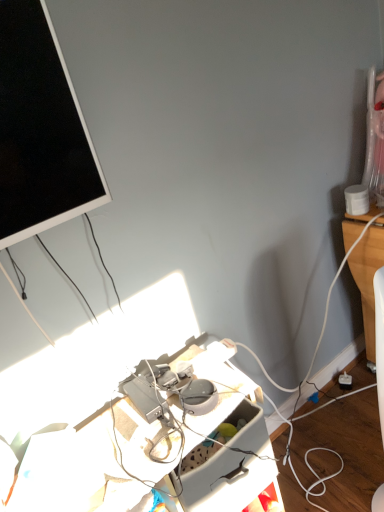
Image resolution: width=384 pixels, height=512 pixels. What do you see at coordinates (345, 381) in the screenshot?
I see `white plastic power outlet at lower right` at bounding box center [345, 381].

What do you see at coordinates (227, 447) in the screenshot? I see `plastic gray desk at center` at bounding box center [227, 447].

Locate an element on the screen. white plastic power outlet at lower right is located at coordinates (345, 381).

Is plastic gray desk at center facing towards white plastic power outlet at lower right?

No, plastic gray desk at center is not oriented towards white plastic power outlet at lower right.

Is white plastic power outlet at lower right inside plastic gray desk at center?

No, plastic gray desk at center does not contain white plastic power outlet at lower right.

Considering the points (196, 487) and (341, 384), which point is behind, point (196, 487) or point (341, 384)?

The point (341, 384) is more distant.

From the image's perspective, between plastic gray desk at center and white plastic power outlet at lower right, which one is located above?

plastic gray desk at center is shown above in the image.

Is white plastic power outlet at lower right inside or outside of matte black screen at upper left?

white plastic power outlet at lower right is located beyond the bounds of matte black screen at upper left.

Considering the relative sizes of white plastic power outlet at lower right and matte black screen at upper left in the image provided, is white plastic power outlet at lower right taller than matte black screen at upper left?

Incorrect, the height of white plastic power outlet at lower right is not larger of that of matte black screen at upper left.

How many degrees apart are the facing directions of white plastic power outlet at lower right and plastic gray desk at center?

9.32 degrees.

From the image's perspective, is white plastic power outlet at lower right below plastic gray desk at center?

Indeed, from the image's perspective, white plastic power outlet at lower right is shown beneath plastic gray desk at center.

Does point (347, 375) lie behind point (173, 439)?

Yes, it is behind point (173, 439).

Is white plastic power outlet at lower right next to plastic gray desk at center and touching it?

No, white plastic power outlet at lower right is not next to plastic gray desk at center.

Does matte black screen at upper left have a greater height compared to white plastic power outlet at lower right?

Indeed, matte black screen at upper left has a greater height compared to white plastic power outlet at lower right.

In the scene shown: Is matte black screen at upper left positioned beyond the bounds of white plastic power outlet at lower right?

Yes.

Is matte black screen at upper left in front of white plastic power outlet at lower right?

Yes, matte black screen at upper left is in front of white plastic power outlet at lower right.

From the image's perspective, relative to matte black screen at upper left, is plastic gray desk at center above or below?

plastic gray desk at center is below matte black screen at upper left.

Consider the image. Is matte black screen at upper left surrounded by plastic gray desk at center?

Actually, matte black screen at upper left is outside plastic gray desk at center.

Could you tell me if plastic gray desk at center is facing matte black screen at upper left?

No, plastic gray desk at center is not oriented towards matte black screen at upper left.

From a real-world perspective, who is located lower, matte black screen at upper left or plastic gray desk at center?

plastic gray desk at center, from a real-world perspective.

Which object is closer to the camera taking this photo, matte black screen at upper left or plastic gray desk at center?

matte black screen at upper left is closer to the camera.

Between point (39, 22) and point (211, 360), which one is positioned behind?

The point (211, 360) is farther from the camera.

Considering the sizes of objects matte black screen at upper left and plastic gray desk at center in the image provided, who is shorter, matte black screen at upper left or plastic gray desk at center?

plastic gray desk at center is shorter.

Where is `computer desk lying above the white plastic power outlet at lower right (from the image's perspective)`? The image size is (384, 512). computer desk lying above the white plastic power outlet at lower right (from the image's perspective) is located at coordinates (227, 447).

The width and height of the screenshot is (384, 512). What are the coordinates of `power outlet below the matte black screen at upper left (from a real-world perspective)` in the screenshot? It's located at (345, 381).

From the image, which object appears to be nearer to white plastic power outlet at lower right, matte black screen at upper left or plastic gray desk at center?

Among the two, plastic gray desk at center is located nearer to white plastic power outlet at lower right.

Which object lies further to the anchor point white plastic power outlet at lower right, plastic gray desk at center or matte black screen at upper left?

matte black screen at upper left is positioned further to the anchor white plastic power outlet at lower right.

Estimate the real-world distances between objects in this image. Which object is further from matte black screen at upper left, plastic gray desk at center or white plastic power outlet at lower right?

white plastic power outlet at lower right.

Which object lies further to the anchor point plastic gray desk at center, matte black screen at upper left or white plastic power outlet at lower right?

Among the two, white plastic power outlet at lower right is located further to plastic gray desk at center.

From the image, which object appears to be nearer to matte black screen at upper left, white plastic power outlet at lower right or plastic gray desk at center?

Among the two, plastic gray desk at center is located nearer to matte black screen at upper left.

Considering their positions, is white plastic power outlet at lower right positioned closer to plastic gray desk at center than matte black screen at upper left?

Based on the image, matte black screen at upper left appears to be nearer to plastic gray desk at center.

Identify the location of computer desk located between matte black screen at upper left and white plastic power outlet at lower right in the depth direction. This screenshot has width=384, height=512. (227, 447).